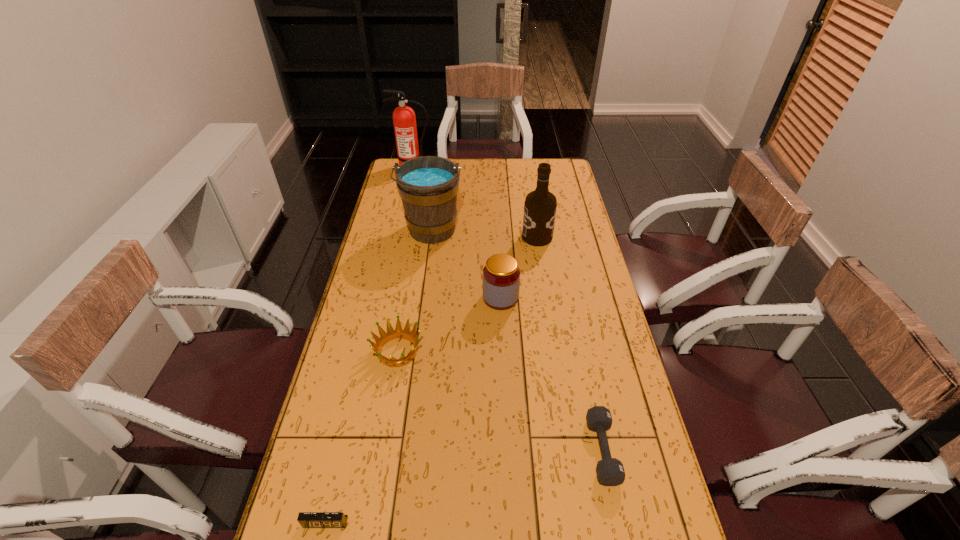
Locate an element on the screen. The width and height of the screenshot is (960, 540). object present at the far edge is located at coordinates (404, 119).

Locate an element on the screen. This screenshot has height=540, width=960. fire extinguisher that is at the left edge is located at coordinates (404, 119).

The height and width of the screenshot is (540, 960). In order to click on wine bucket present at the left edge in this screenshot , I will do `click(428, 185)`.

Identify the location of crown located in the left edge section of the desktop. (391, 334).

Image resolution: width=960 pixels, height=540 pixels. In order to click on alarm clock that is at the left edge in this screenshot , I will do `click(306, 519)`.

Find the location of a particular element. This screenshot has height=540, width=960. alcohol located at the right edge is located at coordinates (540, 206).

You are a GUI agent. You are given a task and a screenshot of the screen. Output one action in this format:
    pyautogui.click(x=<x>, y=<y>)
    Task: Click on the dumbbell at the right edge
    The image size is (960, 540).
    Given the screenshot: What is the action you would take?
    pyautogui.click(x=610, y=471)

You are a GUI agent. You are given a task and a screenshot of the screen. Output one action in this format:
    pyautogui.click(x=<x>, y=<y>)
    Task: Click on the object at the far left corner
    This screenshot has height=540, width=960.
    Given the screenshot: What is the action you would take?
    pyautogui.click(x=404, y=119)

Image resolution: width=960 pixels, height=540 pixels. What are the coordinates of `vacant space at the far edge` in the screenshot? It's located at (499, 163).

Where is `free space at the left edge`? free space at the left edge is located at coordinates (389, 280).